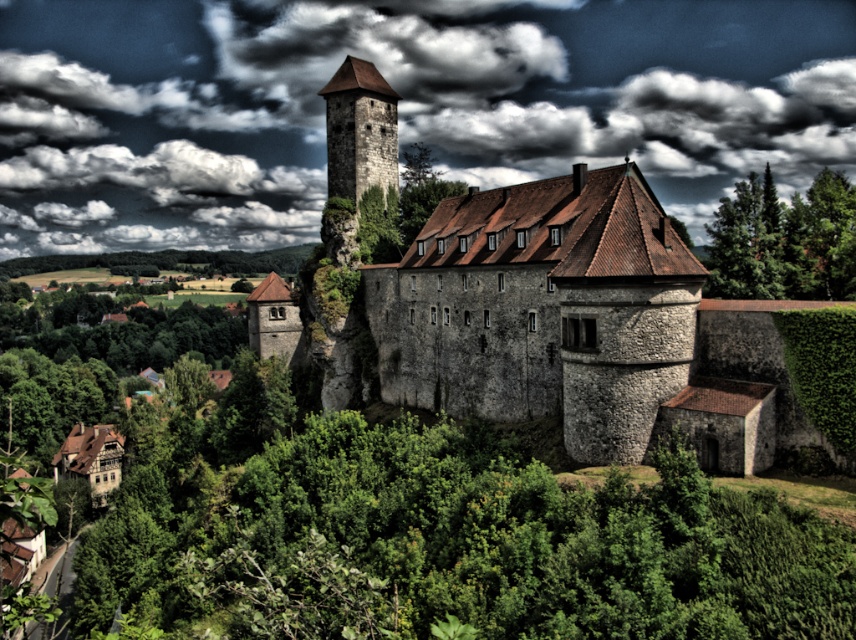
Question: Which point is farther to the camera?

Choices:
 (A) dark gray cloud at upper center
 (B) cloudy sky at upper center
 (C) stone tower at center

Answer: (A)

Question: Can you confirm if dark gray cloud at upper center is positioned below green leafy tree at upper right?

Choices:
 (A) yes
 (B) no

Answer: (B)

Question: Which point is closer to the camera taking this photo?

Choices:
 (A) (474, 81)
 (B) (492, 4)
 (C) (358, 147)
 (D) (851, 216)

Answer: (D)

Question: Does cloudy sky at upper center lie in front of green leafy tree at upper right?

Choices:
 (A) no
 (B) yes

Answer: (A)

Question: Which point is closer to the camera?

Choices:
 (A) cloudy sky at upper center
 (B) dark gray cloud at upper center

Answer: (A)

Question: Can you confirm if stone castle at center is bigger than stone tower at center?

Choices:
 (A) yes
 (B) no

Answer: (A)